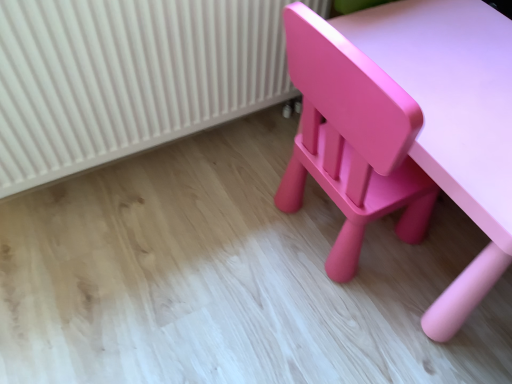
Image resolution: width=512 pixels, height=384 pixels. What are the coordinates of `vacant space underneath white ribbed radiator at upper left (from a real-world perspective)` in the screenshot? It's located at (184, 152).